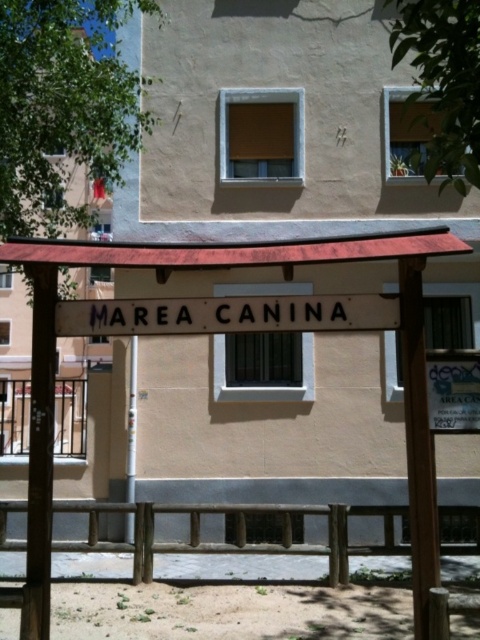
Question: Which point is closer to the camera?

Choices:
 (A) wooden fence at lower center
 (B) white painted wood sign at center
 (C) white plastic pole at center

Answer: (B)

Question: Which object is positioned closest to the white plastic pole at center?

Choices:
 (A) white paper sign at lower right
 (B) wooden fence at lower center
 (C) white painted wood sign at center

Answer: (B)

Question: Estimate the real-world distances between objects in this image. Which object is farther from the white painted wood sign at center?

Choices:
 (A) wooden fence at lower center
 (B) white paper sign at lower right

Answer: (A)

Question: Can you confirm if white painted wood sign at center is smaller than white paper sign at lower right?

Choices:
 (A) yes
 (B) no

Answer: (B)

Question: Does white painted wood sign at center have a lesser width compared to white plastic pole at center?

Choices:
 (A) yes
 (B) no

Answer: (B)

Question: Is white paper sign at lower right above white plastic pole at center?

Choices:
 (A) yes
 (B) no

Answer: (A)